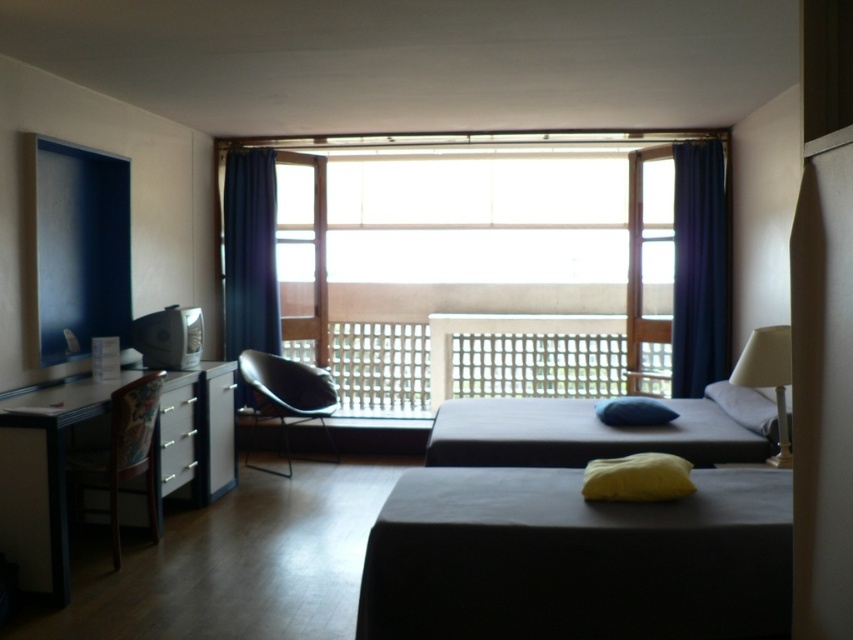
Is patterned fabric armchair at left in front of white fabric lampshade at right?

No, patterned fabric armchair at left is behind white fabric lampshade at right.

Can you confirm if patterned fabric armchair at left is bigger than white fabric lampshade at right?

Correct, patterned fabric armchair at left is larger in size than white fabric lampshade at right.

This screenshot has width=853, height=640. Describe the element at coordinates (120, 456) in the screenshot. I see `patterned fabric armchair at left` at that location.

What are the coordinates of `patterned fabric armchair at left` in the screenshot? It's located at (120, 456).

Does point (247, 376) come in front of point (685, 483)?

That is False.

Does matte black chair at center appear on the left side of yellow fabric pillow at lower center?

Yes, matte black chair at center is to the left of yellow fabric pillow at lower center.

The image size is (853, 640). I want to click on matte black chair at center, so click(286, 394).

The image size is (853, 640). What are the coordinates of `matte black chair at center` in the screenshot? It's located at (286, 394).

Is dark blue fabric curtain at right smaller than white fabric lampshade at right?

Yes.

Locate an element on the screen. This screenshot has width=853, height=640. dark blue fabric curtain at right is located at coordinates pyautogui.click(x=698, y=268).